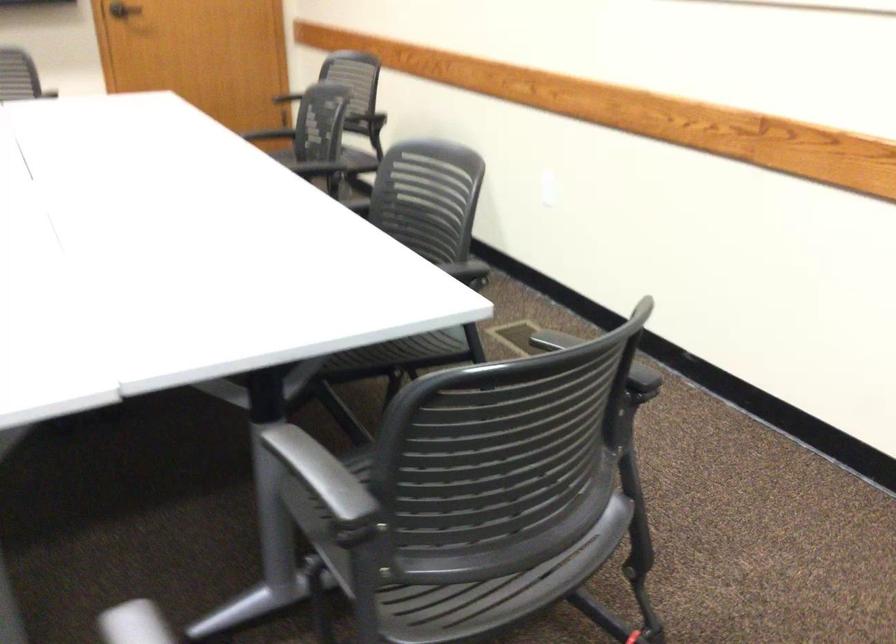
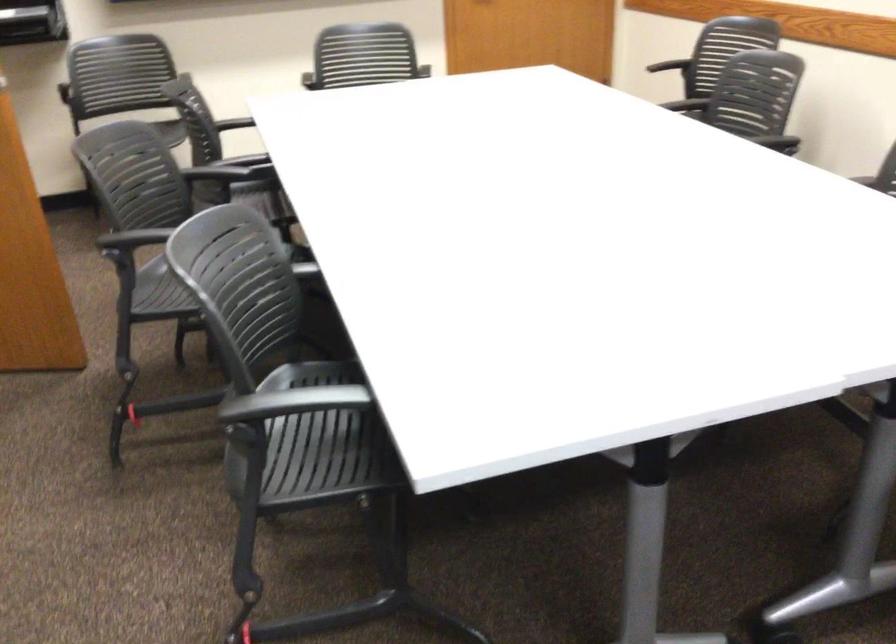
Question: The camera is either moving clockwise (left) or counter-clockwise (right) around the object. The first image is from the beginning of the video and the second image is from the end. Is the camera moving left or right when shooting the video?

Choices:
 (A) Left
 (B) Right

Answer: (B)